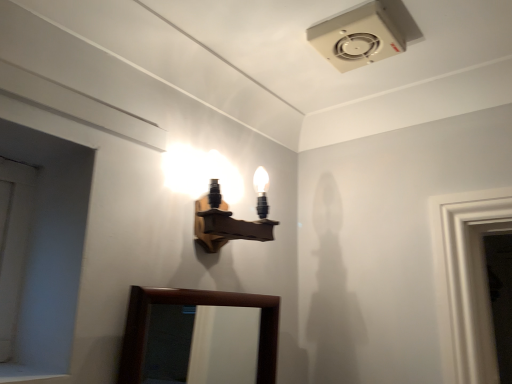
Question: From the image's perspective, is brown wooden mirror at lower center located beneath wooden wall sconce at upper center?

Choices:
 (A) yes
 (B) no

Answer: (A)

Question: Does brown wooden mirror at lower center have a lesser height compared to wooden wall sconce at upper center?

Choices:
 (A) yes
 (B) no

Answer: (B)

Question: Does brown wooden mirror at lower center touch wooden wall sconce at upper center?

Choices:
 (A) yes
 (B) no

Answer: (B)

Question: Can you confirm if brown wooden mirror at lower center is positioned to the right of wooden wall sconce at upper center?

Choices:
 (A) no
 (B) yes

Answer: (A)

Question: Is brown wooden mirror at lower center taller than wooden wall sconce at upper center?

Choices:
 (A) no
 (B) yes

Answer: (B)

Question: Would you say white matte door at left is inside or outside brown wooden mirror at lower center?

Choices:
 (A) inside
 (B) outside

Answer: (B)

Question: From the image's perspective, is white matte door at left located above or below brown wooden mirror at lower center?

Choices:
 (A) above
 (B) below

Answer: (A)

Question: Considering the positions of point (5, 213) and point (201, 342), is point (5, 213) closer or farther from the camera than point (201, 342)?

Choices:
 (A) closer
 (B) farther

Answer: (A)

Question: From their relative heights in the image, would you say white matte door at left is taller or shorter than brown wooden mirror at lower center?

Choices:
 (A) tall
 (B) short

Answer: (B)

Question: Is wooden wall sconce at upper center bigger or smaller than white matte door at left?

Choices:
 (A) big
 (B) small

Answer: (A)

Question: In the image, is wooden wall sconce at upper center on the left side or the right side of white matte door at left?

Choices:
 (A) left
 (B) right

Answer: (B)

Question: Would you say wooden wall sconce at upper center is inside or outside white matte door at left?

Choices:
 (A) inside
 (B) outside

Answer: (B)

Question: From the image's perspective, is wooden wall sconce at upper center located above or below white matte door at left?

Choices:
 (A) above
 (B) below

Answer: (A)

Question: In terms of size, does wooden wall sconce at upper center appear bigger or smaller than brown wooden mirror at lower center?

Choices:
 (A) small
 (B) big

Answer: (A)

Question: Does point (207, 195) appear closer or farther from the camera than point (230, 350)?

Choices:
 (A) closer
 (B) farther

Answer: (A)